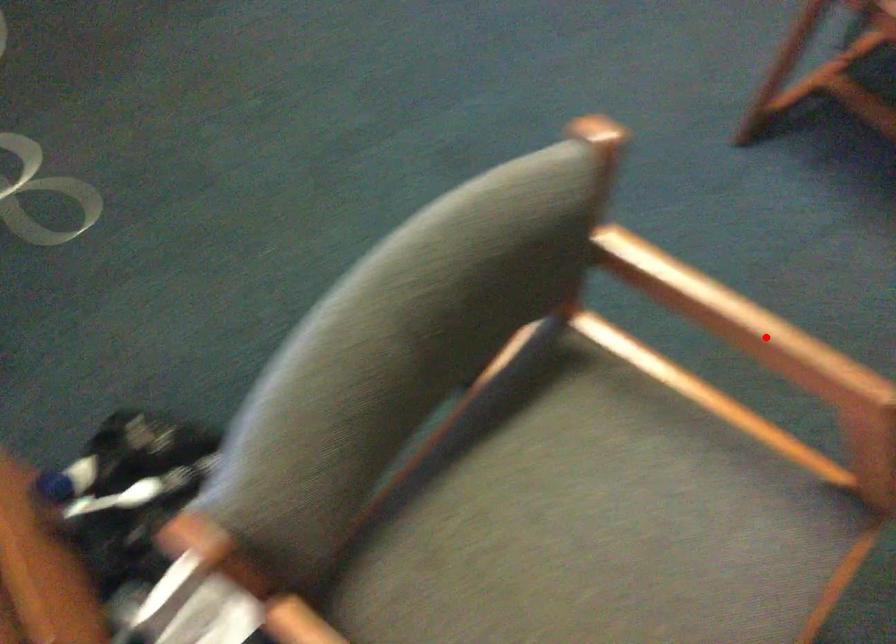
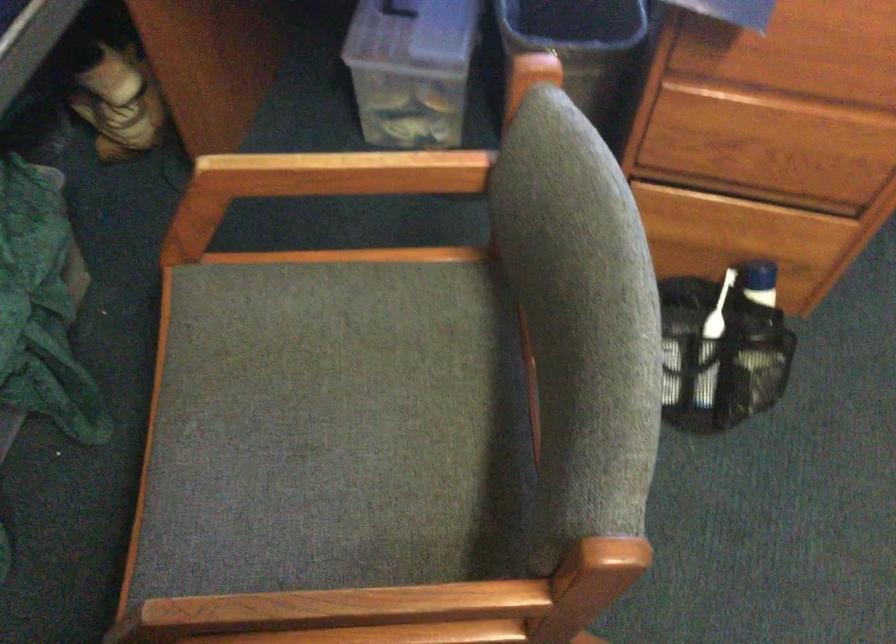
Where in the second image is the point corresponding to the highlighted location from the first image?

(338, 611)